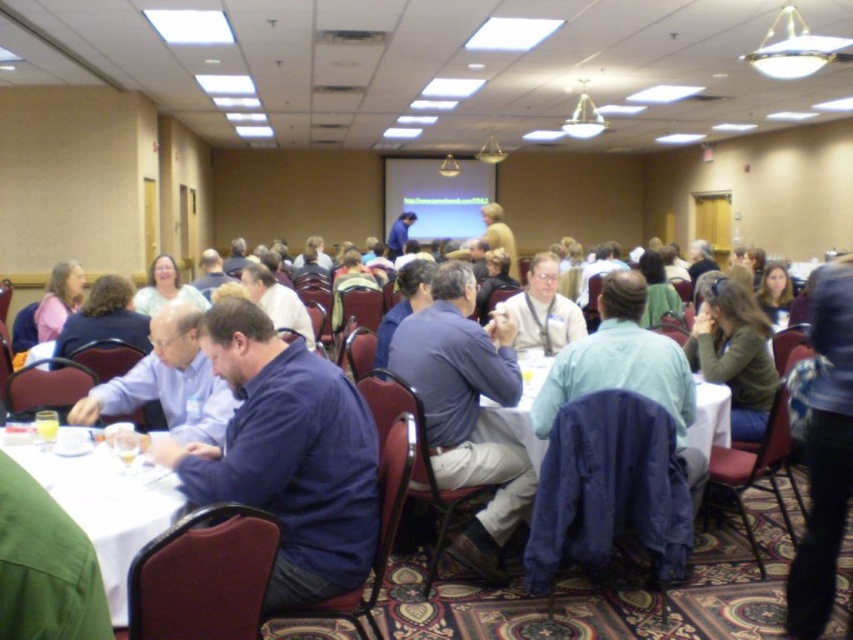
Question: Estimate the real-world distances between objects in this image. Which object is closer to the blue shirt at left?

Choices:
 (A) blue cotton shirt at center
 (B) white glossy table at lower left
 (C) dark blue shirt at center
 (D) white fabric table at center

Answer: (B)

Question: From the image, what is the correct spatial relationship of dark blue shirt at center in relation to white fabric table at center?

Choices:
 (A) below
 (B) above

Answer: (B)

Question: Which of the following is the farthest from the observer?

Choices:
 (A) (724, 394)
 (B) (494, 392)
 (C) (76, 508)
 (D) (366, 497)

Answer: (A)

Question: Does blue shirt at left have a lesser width compared to white fabric table at center?

Choices:
 (A) yes
 (B) no

Answer: (A)

Question: Is dark blue shirt at center further to the viewer compared to blue cotton shirt at center?

Choices:
 (A) yes
 (B) no

Answer: (B)

Question: Which point is closer to the camera?

Choices:
 (A) (418, 312)
 (B) (293, 433)
 (C) (125, 474)

Answer: (B)